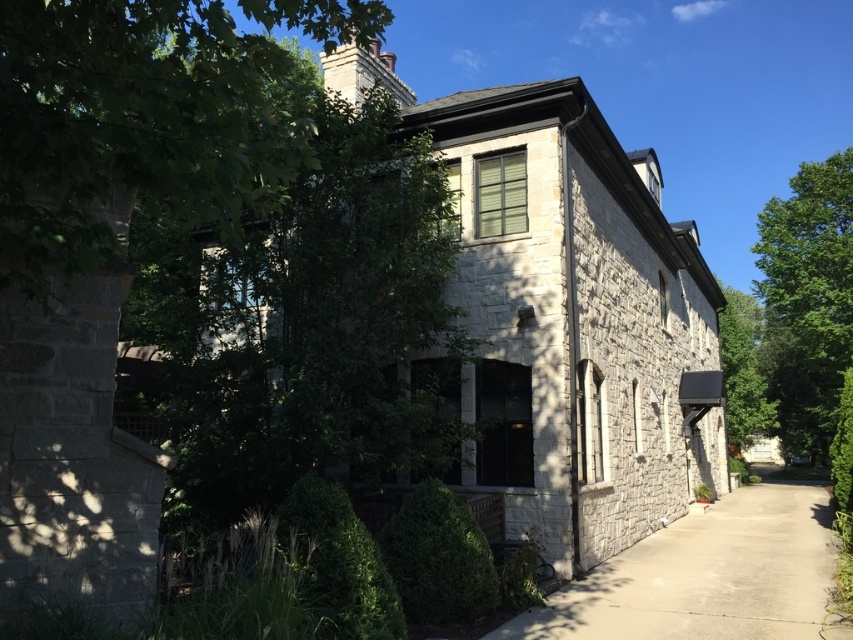
Between green leafy tree at left and concrete at lower right, which one is positioned lower?

concrete at lower right is lower down.

This screenshot has height=640, width=853. Identify the location of green leafy tree at left. (144, 116).

The image size is (853, 640). In order to click on green leafy tree at left in this screenshot , I will do `click(144, 116)`.

Does concrete at lower right have a greater width compared to green leafy tree at right?

No, concrete at lower right is not wider than green leafy tree at right.

Is concrete at lower right smaller than green leafy tree at right?

Indeed, concrete at lower right has a smaller size compared to green leafy tree at right.

Which is behind, point (796, 628) or point (764, 257)?

The point (764, 257) is more distant.

Where is `concrete at lower right`? Image resolution: width=853 pixels, height=640 pixels. concrete at lower right is located at coordinates (705, 577).

Consider the image. Who is more distant from viewer, (76,163) or (779,400)?

The point (779,400) is behind.

This screenshot has height=640, width=853. What do you see at coordinates (144, 116) in the screenshot?
I see `green leafy tree at left` at bounding box center [144, 116].

The image size is (853, 640). I want to click on green leafy tree at left, so click(x=144, y=116).